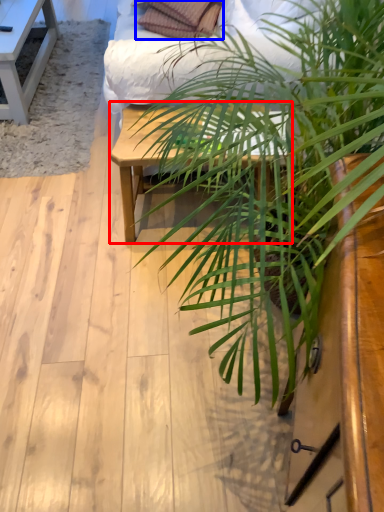
Question: Which object appears farthest to the camera in this image, table (highlighted by a red box) or pillow (highlighted by a blue box)?

Choices:
 (A) table
 (B) pillow

Answer: (B)